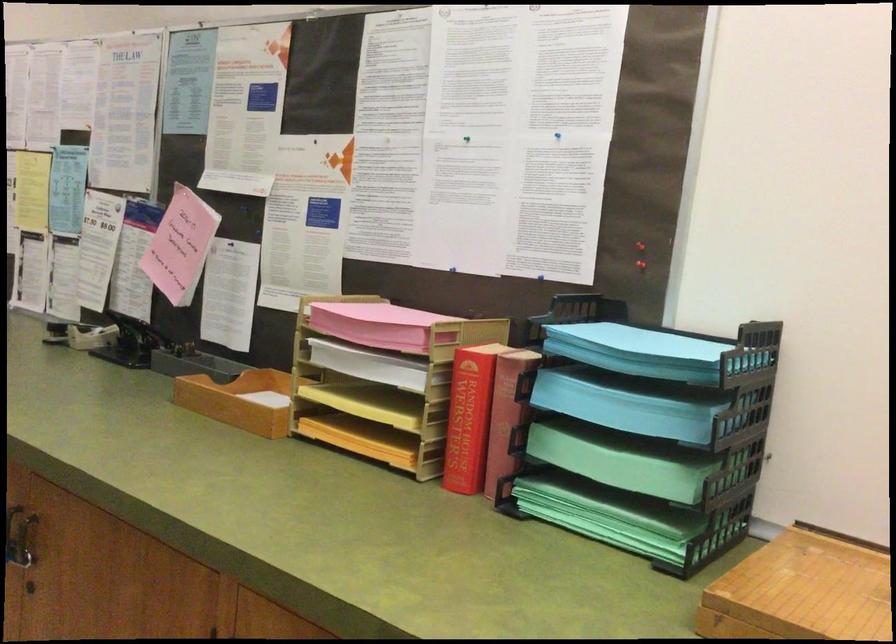
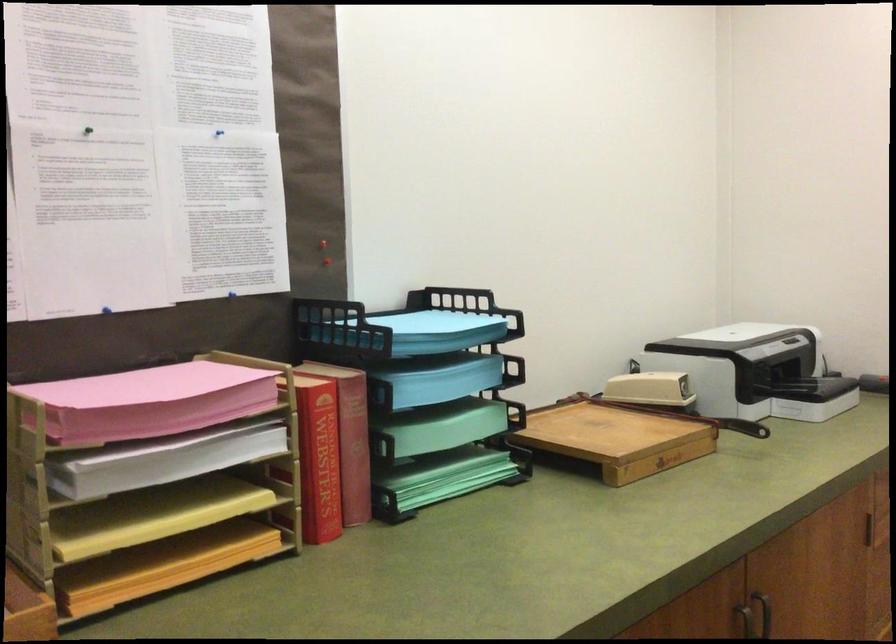
Find the pixel in the second image that matches point 560,136 in the first image.

(218, 136)